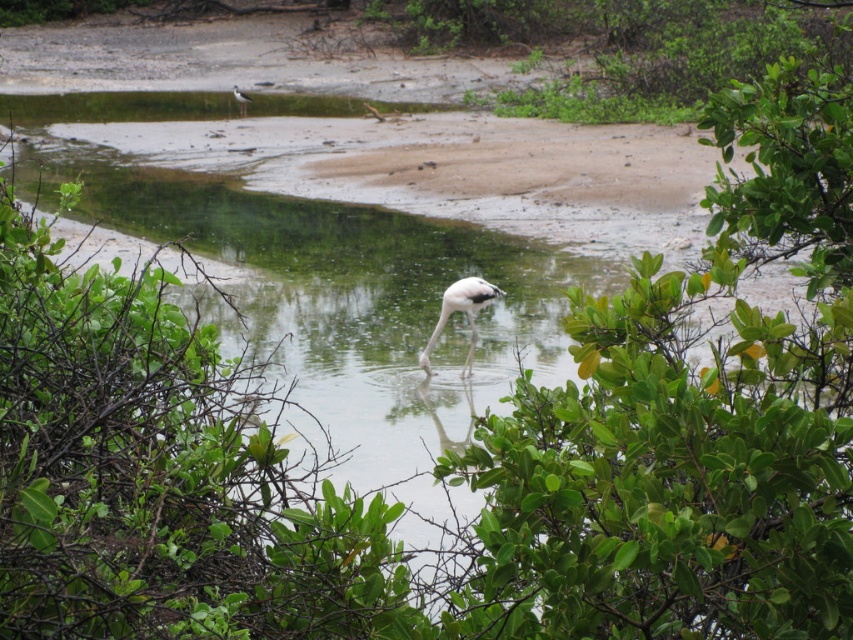
Can you confirm if white matte flamingo at center is wider than white matte bird at upper left?

Indeed, white matte flamingo at center has a greater width compared to white matte bird at upper left.

Where is `white matte flamingo at center`? This screenshot has width=853, height=640. white matte flamingo at center is located at coordinates (462, 310).

Is point (457, 304) behind point (247, 97)?

No, (457, 304) is in front of (247, 97).

Where is `white matte flamingo at center`? white matte flamingo at center is located at coordinates click(x=462, y=310).